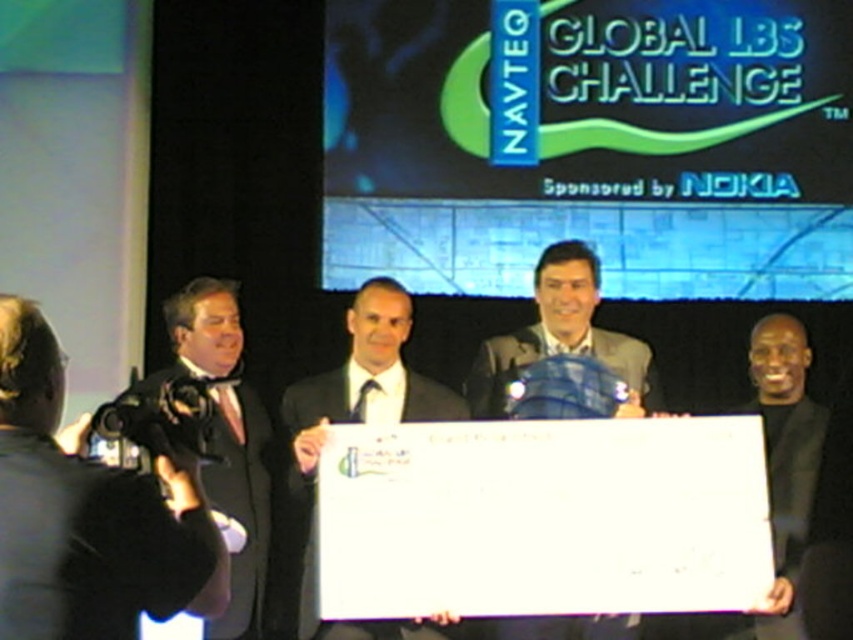
You are a photographer at the event and need to determine if your black glossy camera at left can fit into a case designed for the black satin suit at left. Based on their sizes, will the camera fit?

The black glossy camera at left has a larger width than the black satin suit at left, so it will not fit into the case designed for the black satin suit at left.

Consider the image. You are standing at the point closest to the camera. Which point, point (242, 433) or point (514, 636), is farther away from you?

Point (242, 433) is behind point (514, 636), so it is farther away from you.

You are a photographer at the NAVTEQ event and need to capture a closeup of the black satin suit at left and the gray fabric suit at center. Since your camera has a limited focus range, which suit should you focus on to ensure both are in frame?

The black satin suit at left is larger in size than the gray fabric suit at center, so focusing on the black satin suit at left would ensure both suits are within the camera focus range.